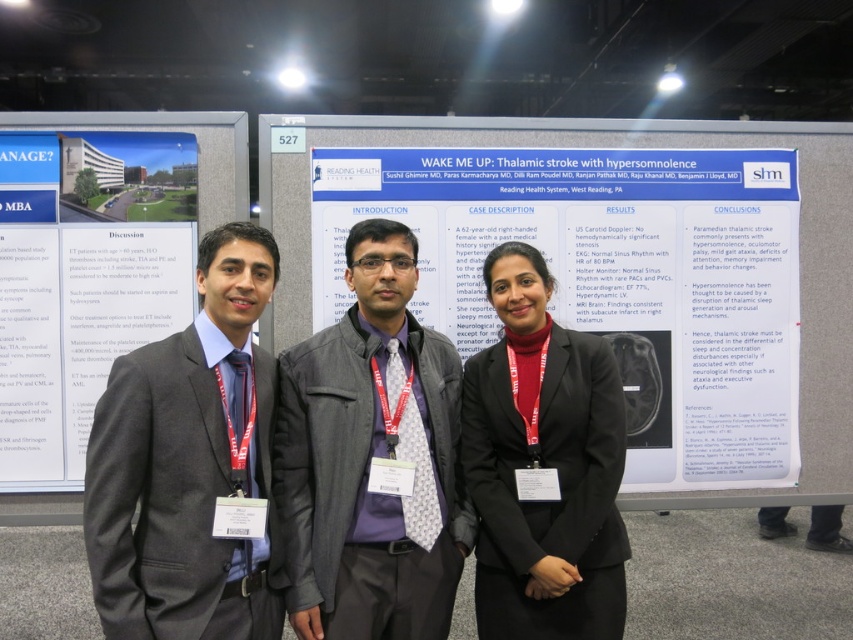
Is point (357, 337) more distant than point (270, 257)?

Yes, it is behind point (270, 257).

Identify the location of gray fabric jacket at center. This screenshot has height=640, width=853. (370, 458).

Locate an element on the screen. gray fabric jacket at center is located at coordinates (370, 458).

Is gray fabric jacket at center above blue paperboard poster at left?

Incorrect, gray fabric jacket at center is not positioned above blue paperboard poster at left.

Is gray fabric jacket at center positioned behind blue paperboard poster at left?

No, it is not.

What do you see at coordinates (370, 458) in the screenshot? This screenshot has height=640, width=853. I see `gray fabric jacket at center` at bounding box center [370, 458].

Where is `gray fabric jacket at center`? The width and height of the screenshot is (853, 640). gray fabric jacket at center is located at coordinates (370, 458).

Can you confirm if gray fabric jacket at center is positioned above matte black blazer at center?

Yes, gray fabric jacket at center is above matte black blazer at center.

Is point (434, 387) less distant than point (602, 563)?

No.

Identify the location of gray fabric jacket at center. This screenshot has width=853, height=640. (370, 458).

At what (x,y) coordinates should I click in order to perform the action: click on gray fabric jacket at center. Please return your answer as a coordinate pair (x, y). This screenshot has width=853, height=640. Looking at the image, I should click on (370, 458).